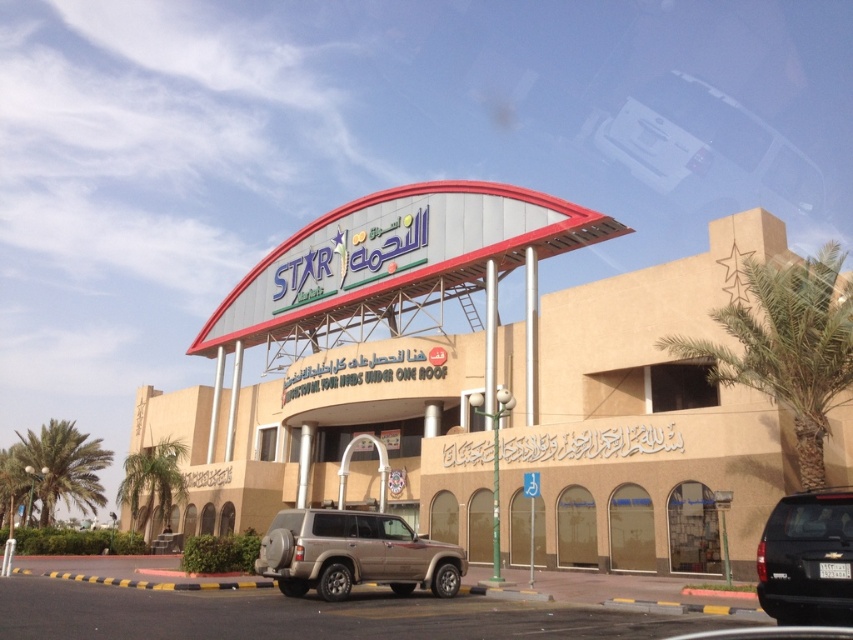
You are standing in front of the commercial building and want to take a photo. You notice two points marked in the scene. The first point is at coordinate point (732, 312) and the second is at point (305, 540). Which point is closer to your camera?

Point (305, 540) is closer to the camera because the description states that point (732, 312) is further away from the camera than point (305, 540).